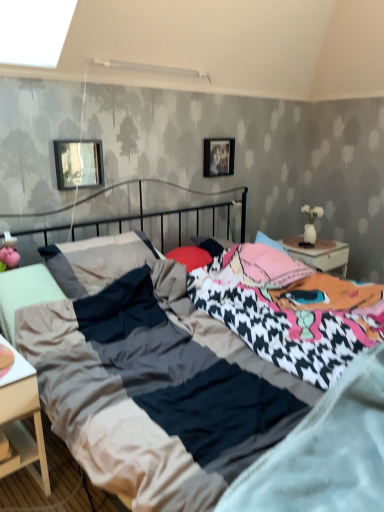
Question: Is metallic silver picture frame at upper center, the 2th picture frame from the left, wider or thinner than metallic rectangular frame at upper left, which ranks as the second picture frame in back-to-front order?

Choices:
 (A) wide
 (B) thin

Answer: (B)

Question: Based on their sizes in the image, would you say metallic silver picture frame at upper center, marked as the 1th picture frame in a back-to-front arrangement, is bigger or smaller than metallic rectangular frame at upper left, which ranks as the second picture frame in back-to-front order?

Choices:
 (A) small
 (B) big

Answer: (A)

Question: Which object is positioned closest to the textured cotton bed at center?

Choices:
 (A) soft cotton mattress at center
 (B) metallic silver picture frame at upper center, which is the second picture frame from front to back
 (C) white matte nightstand at lower left
 (D) metallic rectangular frame at upper left, which ranks as the second picture frame in back-to-front order

Answer: (A)

Question: Which of these objects is positioned closest to the metallic rectangular frame at upper left, which ranks as the second picture frame in back-to-front order?

Choices:
 (A) white matte nightstand at lower left
 (B) textured cotton bed at center
 (C) metallic silver picture frame at upper center, which is the second picture frame from front to back
 (D) soft cotton mattress at center

Answer: (B)